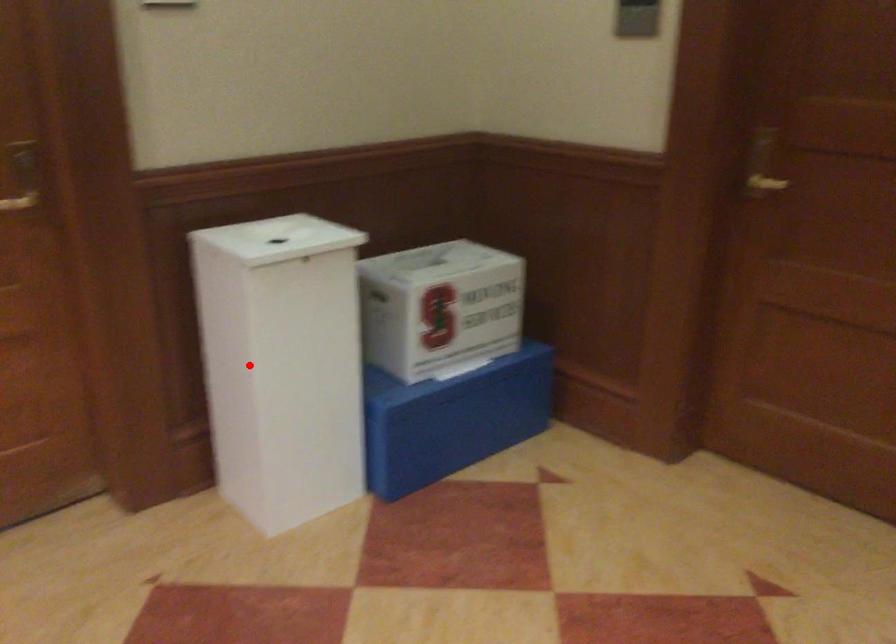
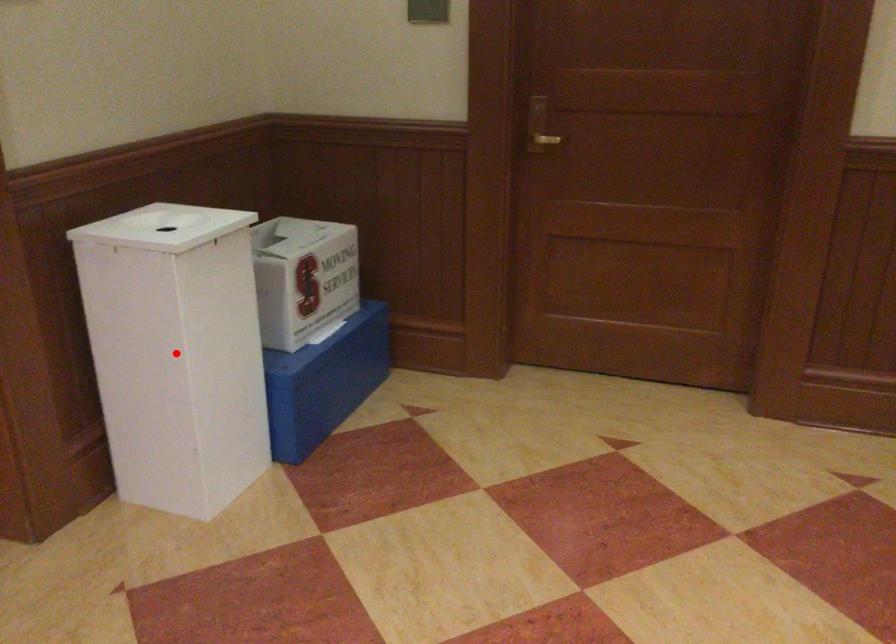
I am providing you with two images of the same scene from different viewpoints. A red point is marked on the first image and another point is marked on the second image. Do the highlighted points in image1 and image2 indicate the same real-world spot?

Yes